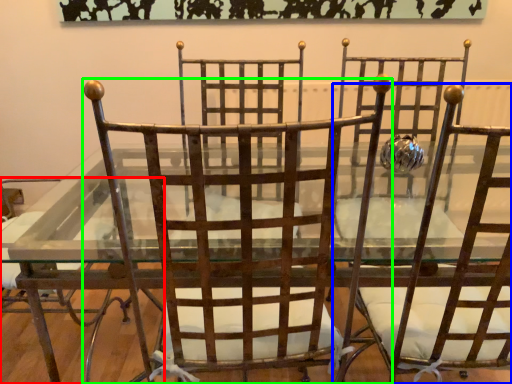
Question: Considering the real-world distances, which object is closest to chair (highlighted by a red box)? chair (highlighted by a blue box) or chair (highlighted by a green box).

Choices:
 (A) chair
 (B) chair

Answer: (B)